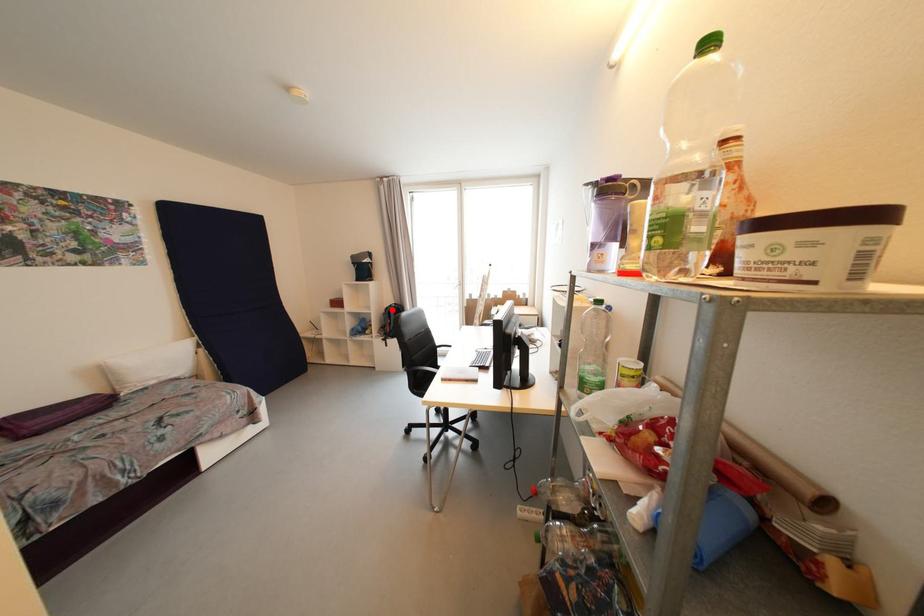
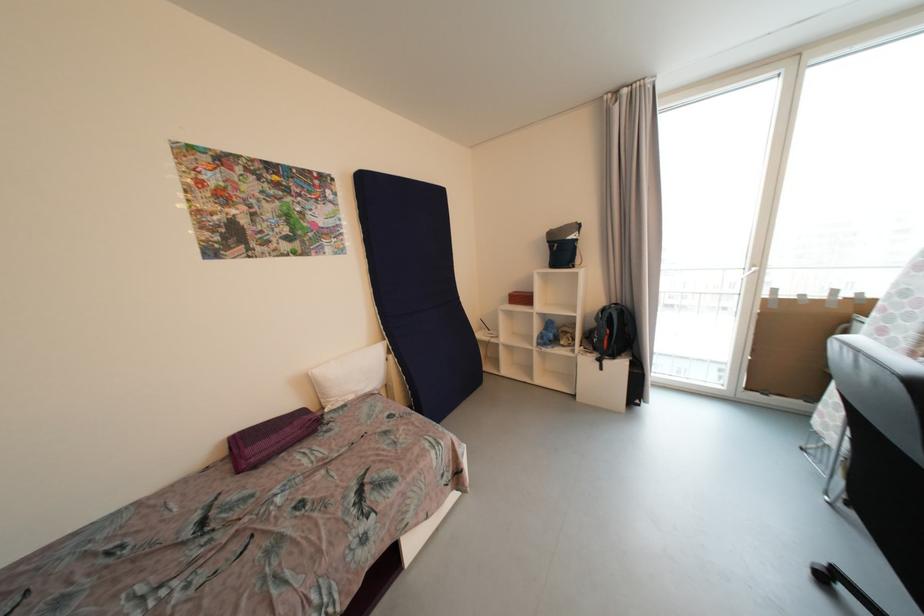
In the second image, find the point that corresponds to the highlighted location in the first image.

(608, 312)